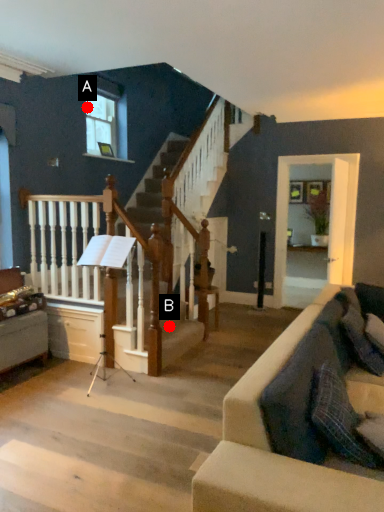
Question: Two points are circled on the image, labeled by A and B beside each circle. Which of the following is the closest to the observer?

Choices:
 (A) A is closer
 (B) B is closer

Answer: (B)